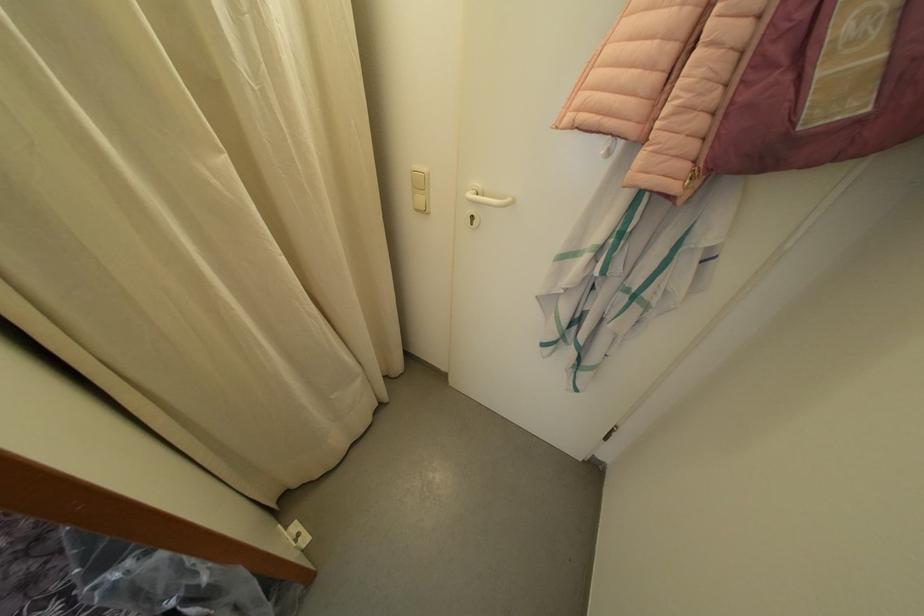
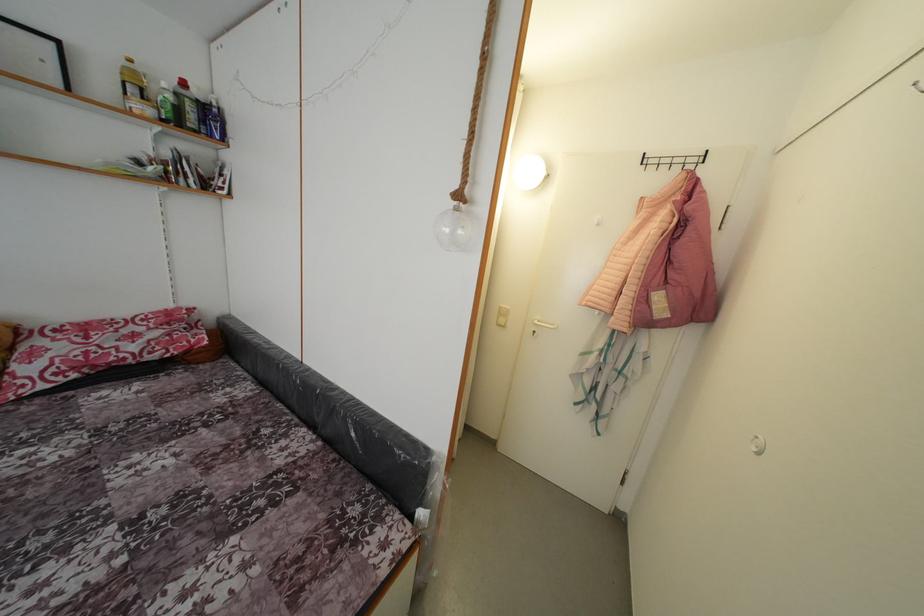
Which direction would the cameraman need to move to produce the second image?

The cameraman moved toward left, backward.